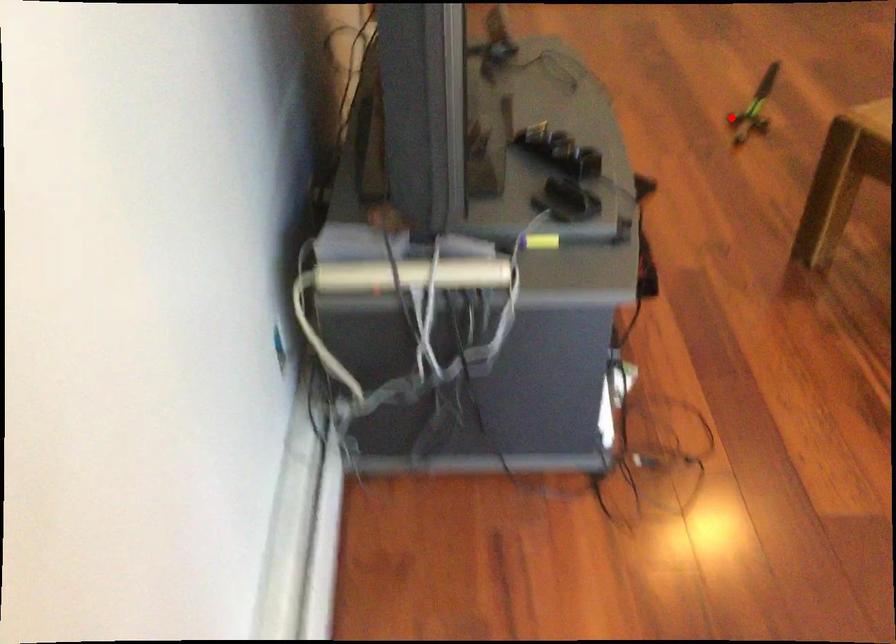
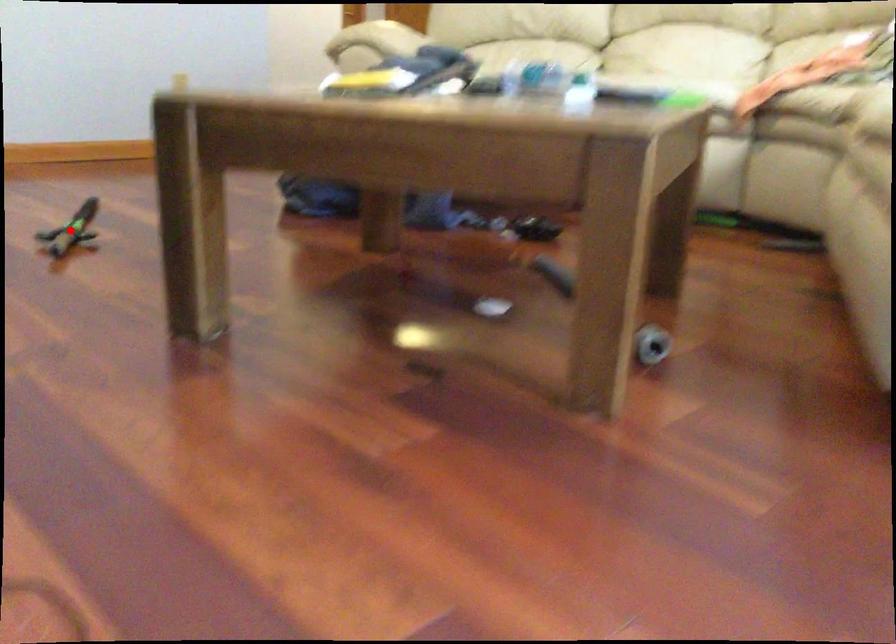
I am providing you with two images of the same scene from different viewpoints. A red point is marked on the first image and another point is marked on the second image. Are the points marked in image1 and image2 representing the same 3D position?

Yes